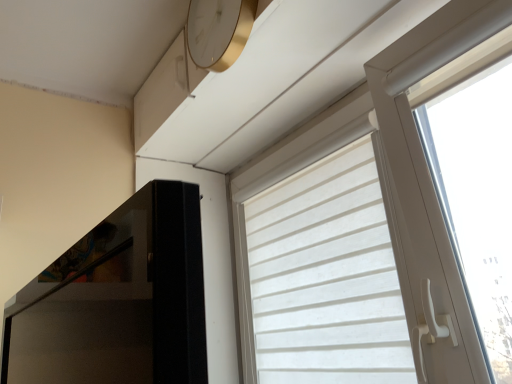
Question: From a real-world perspective, is white fabric curtain at upper right physically above white matte window at upper right?

Choices:
 (A) yes
 (B) no

Answer: (B)

Question: Considering the relative sizes of white fabric curtain at upper right and white matte window at upper right in the image provided, is white fabric curtain at upper right thinner than white matte window at upper right?

Choices:
 (A) no
 (B) yes

Answer: (B)

Question: Is white fabric curtain at upper right located outside white matte window at upper right?

Choices:
 (A) no
 (B) yes

Answer: (A)

Question: Does white fabric curtain at upper right lie in front of white matte window at upper right?

Choices:
 (A) yes
 (B) no

Answer: (B)

Question: Does white fabric curtain at upper right have a larger size compared to white matte window at upper right?

Choices:
 (A) yes
 (B) no

Answer: (B)

Question: Based on their positions, is white fabric curtain at upper right located to the left or right of white matte window at upper right?

Choices:
 (A) right
 (B) left

Answer: (B)

Question: From a real-world perspective, relative to white matte window at upper right, is white fabric curtain at upper right vertically above or below?

Choices:
 (A) above
 (B) below

Answer: (B)

Question: Is point (375, 208) positioned closer to the camera than point (453, 57)?

Choices:
 (A) closer
 (B) farther

Answer: (B)

Question: Looking at the image, does white fabric curtain at upper right seem bigger or smaller compared to white matte window at upper right?

Choices:
 (A) big
 (B) small

Answer: (B)

Question: Choose the correct answer: Is gold metallic clock at upper center inside white matte window at upper right or outside it?

Choices:
 (A) outside
 (B) inside

Answer: (A)

Question: Based on their sizes in the image, would you say gold metallic clock at upper center is bigger or smaller than white matte window at upper right?

Choices:
 (A) small
 (B) big

Answer: (A)

Question: From a real-world perspective, is gold metallic clock at upper center physically located above or below white matte window at upper right?

Choices:
 (A) below
 (B) above

Answer: (B)

Question: Does point (250, 23) appear closer or farther from the camera than point (267, 158)?

Choices:
 (A) farther
 (B) closer

Answer: (B)

Question: Is white matte window at upper right wider or thinner than white fabric curtain at upper right?

Choices:
 (A) thin
 (B) wide

Answer: (B)

Question: Considering the positions of white matte window at upper right and white fabric curtain at upper right in the image, is white matte window at upper right taller or shorter than white fabric curtain at upper right?

Choices:
 (A) short
 (B) tall

Answer: (B)